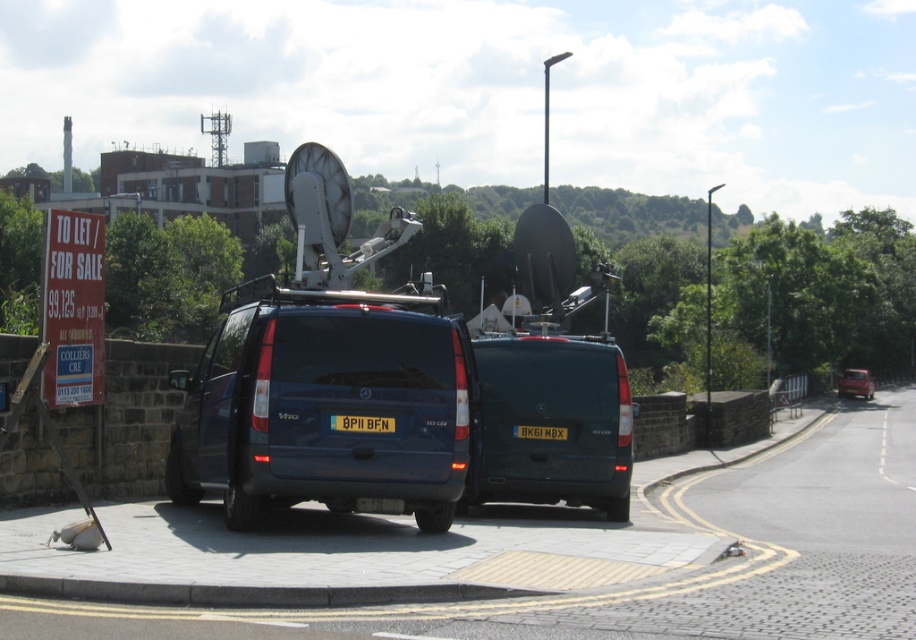
Between matte black van at center and yellow matte license plate at rear, which one is positioned higher?

yellow matte license plate at rear is higher up.

Can you confirm if matte black van at center is shorter than yellow matte license plate at rear?

Incorrect, matte black van at center's height does not fall short of yellow matte license plate at rear's.

Identify the location of matte black van at center. (324, 404).

You are a GUI agent. You are given a task and a screenshot of the screen. Output one action in this format:
    pyautogui.click(x=<x>, y=<y>)
    Task: Click on the matte black van at center
    The width and height of the screenshot is (916, 640).
    Given the screenshot: What is the action you would take?
    pyautogui.click(x=324, y=404)

How far apart are yellow matte license plate at rear and black plastic license plate at rear?

12.19 feet

Who is shorter, yellow matte license plate at rear or black plastic license plate at rear?

With less height is yellow matte license plate at rear.

Between point (337, 429) and point (515, 428), which one is positioned in front?

Point (337, 429) is more forward.

The height and width of the screenshot is (640, 916). I want to click on yellow matte license plate at rear, so click(362, 422).

Does yellow matte license plate at rear have a lesser height compared to metallic red car at right?

Correct, yellow matte license plate at rear is not as tall as metallic red car at right.

How far apart are yellow matte license plate at rear and metallic red car at right?

A distance of 222.89 feet exists between yellow matte license plate at rear and metallic red car at right.

Is point (380, 429) closer to camera compared to point (865, 374)?

Yes, it is in front of point (865, 374).

Where is `yellow matte license plate at rear`? yellow matte license plate at rear is located at coordinates (362, 422).